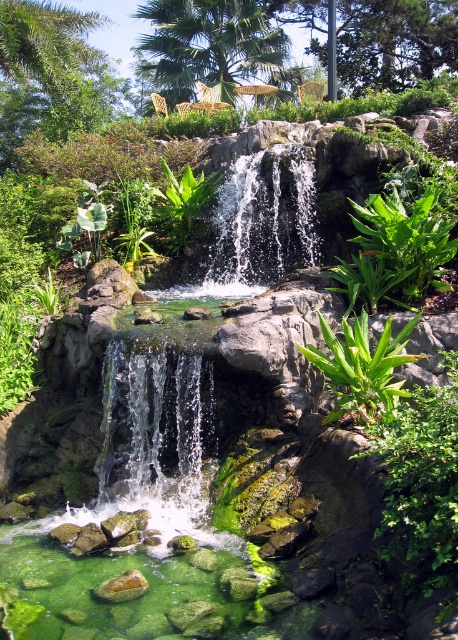
Question: Does clear water cascade at center have a larger size compared to green leafy plant at center?

Choices:
 (A) yes
 (B) no

Answer: (A)

Question: Is clear water cascade at center above clear glass waterfall at center?

Choices:
 (A) no
 (B) yes

Answer: (A)

Question: Does clear glass waterfall at center have a smaller size compared to green leafy plant at center?

Choices:
 (A) yes
 (B) no

Answer: (B)

Question: Which point is farther from the camera taking this photo?

Choices:
 (A) (382, 410)
 (B) (170, 433)
 (C) (219, 208)

Answer: (C)

Question: Estimate the real-world distances between objects in this image. Which object is farther from the clear water cascade at center?

Choices:
 (A) green leafy plant at center
 (B) clear glass waterfall at center

Answer: (B)

Question: Based on their relative distances, which object is farther from the green leafy plant at center?

Choices:
 (A) clear glass waterfall at center
 (B) clear water cascade at center

Answer: (A)